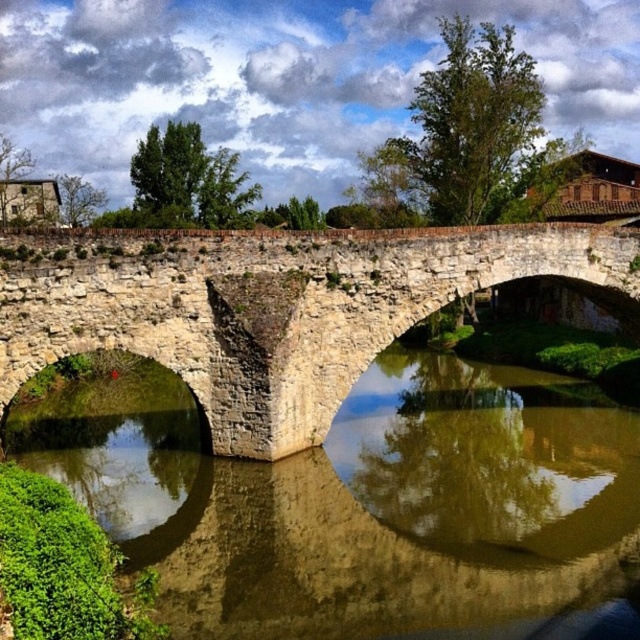
You are an architect analyzing the structural integrity of the stone arch bridge at center. Considering the brown stone water at center is shorter than the bridge, does the water level pose a risk of undermining the bridge foundation?

The brown stone water at center is shorter than the stone arch bridge at center, meaning the water level is lower than the bridge. This suggests the water is not currently at a level that would undermine the bridge foundation.

You are standing at the edge of the brown stone water at center and want to throw a pebble to see how far it travels before sinking. If the pebble sinks after traveling 20 meters, will it reach the opposite bank?

The distance between you and the camera is 21.31 meters. Since the pebble only travels 20 meters, it won not reach the opposite bank.